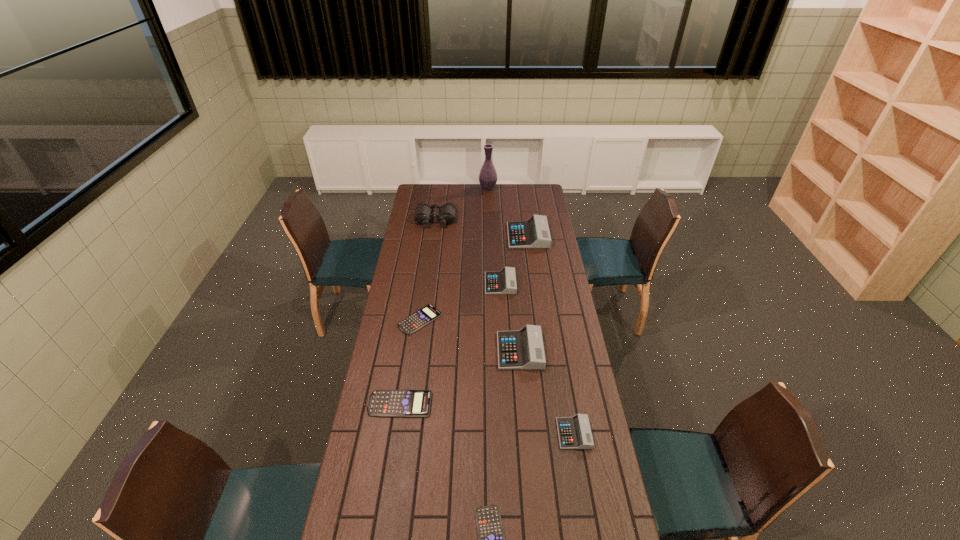
Identify the location of gray calculator that can be found as the closest to the biggest blue calculator. The width and height of the screenshot is (960, 540). (523, 349).

Locate which blue calculator ranks third in proximity to the fifth tallest object. Please provide its 2D coordinates. Your answer should be formatted as a tuple, i.e. [(x, y)], where the tuple contains the x and y coordinates of a point satisfying the conditions above.

[(491, 537)]

At what (x,y) coordinates should I click in order to perform the action: click on blue calculator that can be found as the second closest to the second tallest calculator. Please return your answer as a coordinate pair (x, y). The image size is (960, 540). Looking at the image, I should click on (384, 403).

What are the coordinates of `vacant space that satisfies the following two spatial constraints: 1. through the eyepieces of the second smallest gray calculator; 2. on the left side of the eighth shortest object` in the screenshot? It's located at (427, 284).

Locate an element on the screen. This screenshot has width=960, height=540. vacant region that satisfies the following two spatial constraints: 1. through the eyepieces of the tallest calculator; 2. on the right side of the binoculars is located at coordinates (434, 236).